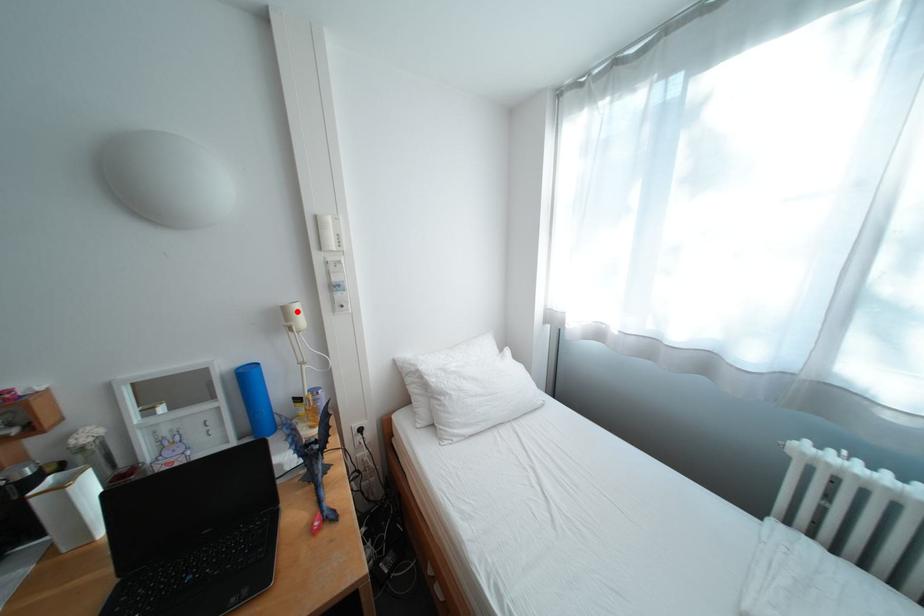
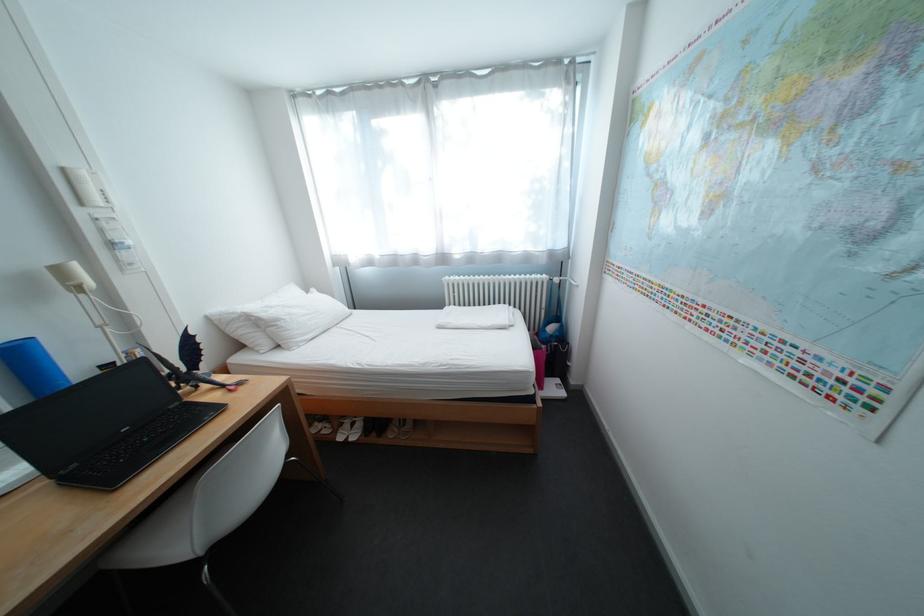
The point at the highlighted location is marked in the first image. Where is the corresponding point in the second image?

(71, 272)